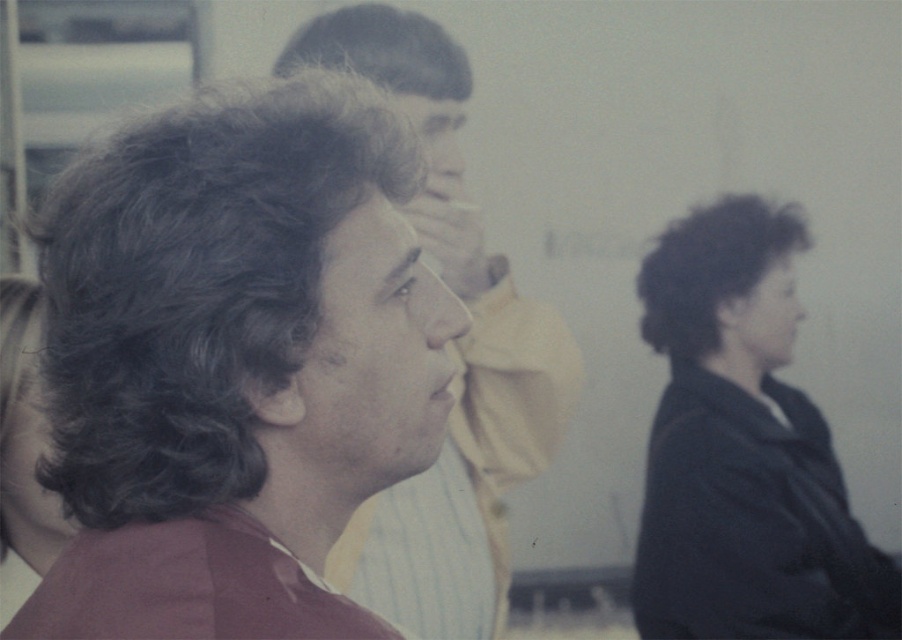
You are a photographer trying to adjust the lighting in the classroom. You notice two people with dark brown hair at left and matte brown hair at center. Which person requires more lighting adjustment if the one closer to the camera needs brighter lighting?

The dark brown hair at left requires more lighting adjustment because it has a lesser height compared to matte brown hair at center, meaning it is closer to the camera and thus needs brighter lighting.

You are standing at the origin point of the coordinate system in the image. You see two points labeled as point (x=388, y=122) and point (x=798, y=634). Which point is closer to you?

Point (x=388, y=122) is in front of point (x=798, y=634), so it is closer to you.

You are a photographer trying to capture a candid shot of the dark brown hair at left and the black matte jacket at lower right. Based on their positions, can you determine which object is closer to the camera?

The dark brown hair at left is positioned over the black matte jacket at lower right, which means it is closer to the camera.